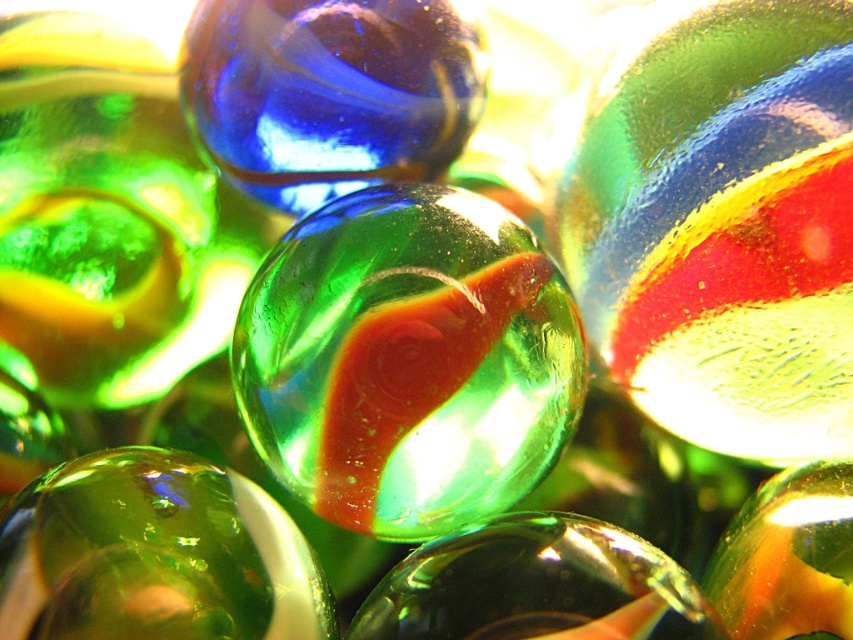
You have two marbles in front of you, the green translucent marble at center and the transparent blue glass bead at center. Which one is wider?

The transparent blue glass bead at center is wider than the green translucent marble at center.

You are a jeweler examining two marbles in the image. You need to determine which one is taller. Which one is taller between the transparent blue glass bead at center and the green glossy marble at center?

The transparent blue glass bead at center is taller than the green glossy marble at center according to the description.

You are a child who wants to pick up both the green translucent marble at center and the transparent blue glass bead at center. Which one is bigger?

The green translucent marble at center is larger in size than the transparent blue glass bead at center, so the green translucent marble at center is bigger.